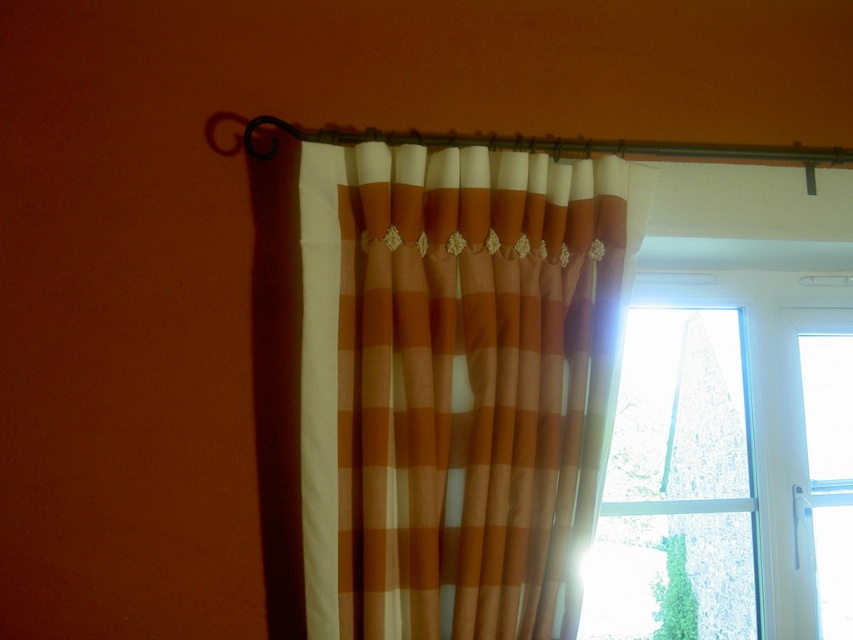
Question: Is orange and white checkered curtain at center positioned in front of transparent glass window at right?

Choices:
 (A) yes
 (B) no

Answer: (A)

Question: Observing the image, what is the correct spatial positioning of orange and white checkered curtain at center in reference to transparent glass window at right?

Choices:
 (A) left
 (B) right

Answer: (A)

Question: Which of the following is the farthest from the observer?

Choices:
 (A) (495, 436)
 (B) (596, 540)

Answer: (B)

Question: Among these points, which one is nearest to the camera?

Choices:
 (A) (630, 438)
 (B) (555, 346)

Answer: (B)

Question: Is orange and white checkered curtain at center to the right of transparent glass window at right from the viewer's perspective?

Choices:
 (A) yes
 (B) no

Answer: (B)